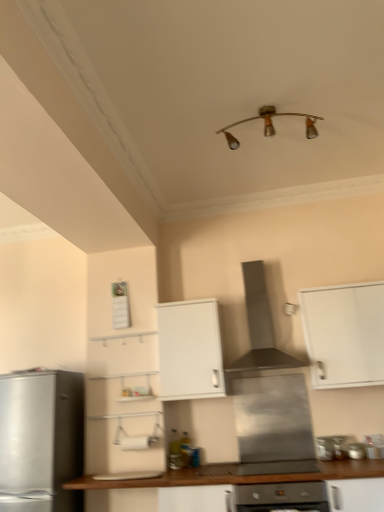
Question: From a real-world perspective, is satin silver oven at center positioned above or below metallic silver stove at lower center, the 3th appliance in the left-to-right sequence?

Choices:
 (A) above
 (B) below

Answer: (B)

Question: In terms of height, does satin silver oven at center look taller or shorter compared to metallic silver stove at lower center, the 3th appliance in the left-to-right sequence?

Choices:
 (A) short
 (B) tall

Answer: (B)

Question: Which is nearer to the stainless steel range hood at center, the 3th appliance viewed from the right?

Choices:
 (A) stainless steel range hood at center
 (B) silver metallic refrigerator at left
 (C) white matte cabinet at upper right, positioned as the first cabinetry in right-to-left order
 (D) wooden countertop at lower center
 (E) white matte cabinet at center, the 2th cabinetry in the right-to-left sequence

Answer: (D)

Question: Which of these objects is positioned farthest from the white matte cabinet at upper right, which appears as the 2th cabinetry when viewed from the left?

Choices:
 (A) silver metallic refrigerator at left
 (B) satin silver oven at center
 (C) metallic silver stove at lower center, the 3th appliance in the left-to-right sequence
 (D) white matte cabinet at center, which ranks as the 1th cabinetry in left-to-right order
 (E) stainless steel range hood at center, placed as the 1th appliance when sorted from left to right

Answer: (A)